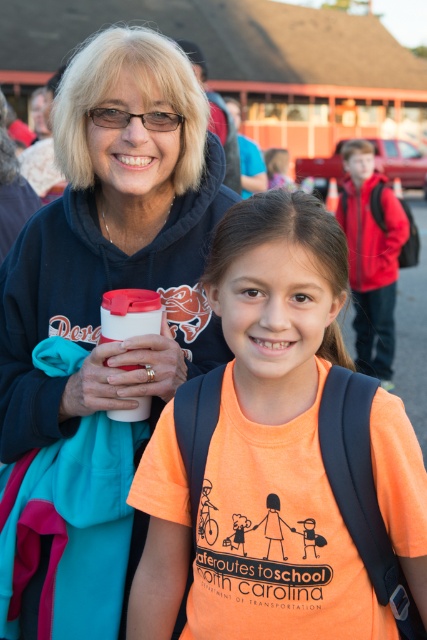
Question: Which object is farther from the camera taking this photo?

Choices:
 (A) matte black hoodie at upper left
 (B) orange cotton shirt at center

Answer: (A)

Question: Among these objects, which one is nearest to the camera?

Choices:
 (A) matte black hoodie at upper left
 (B) orange cotton shirt at center

Answer: (B)

Question: Which point is farther from the camera taking this photo?

Choices:
 (A) (274, 257)
 (B) (81, 49)

Answer: (B)

Question: Does orange cotton shirt at center appear under matte black hoodie at upper left?

Choices:
 (A) no
 (B) yes

Answer: (B)

Question: Is orange cotton shirt at center positioned in front of matte black hoodie at upper left?

Choices:
 (A) yes
 (B) no

Answer: (A)

Question: Where is orange cotton shirt at center located in relation to matte black hoodie at upper left in the image?

Choices:
 (A) above
 (B) below

Answer: (B)